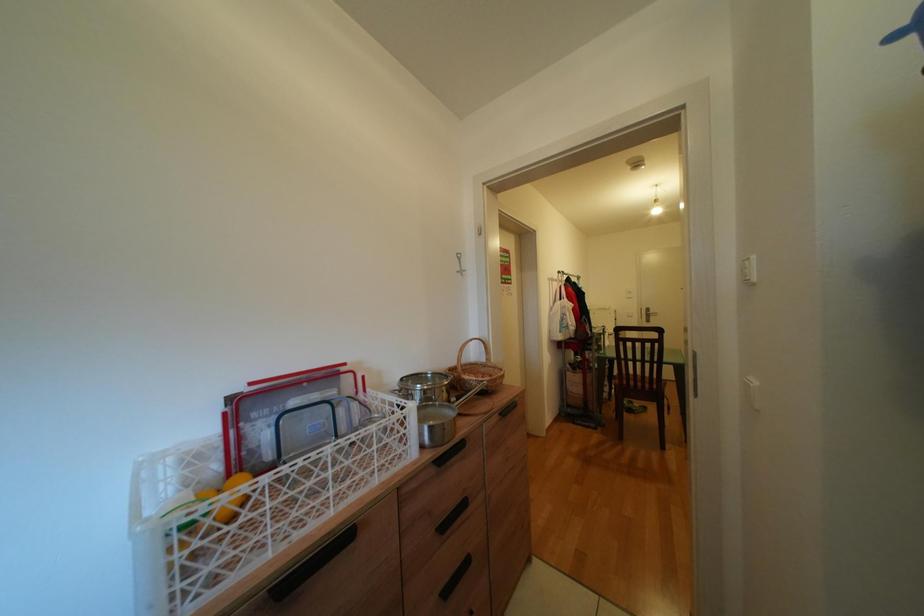
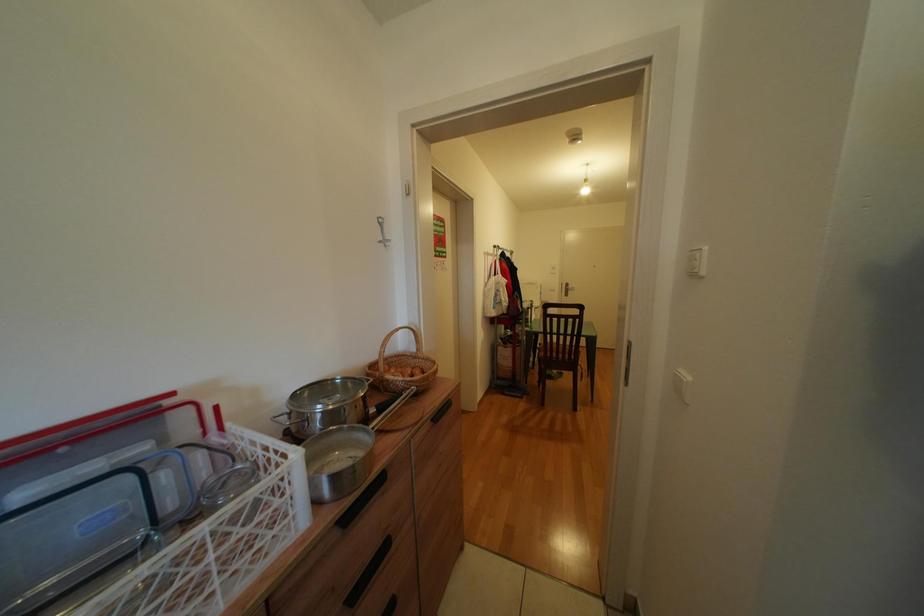
Question: In a continuous first-person perspective shot, in which direction is the camera moving?

Choices:
 (A) Left
 (B) Right
 (C) Forward
 (D) Backward

Answer: (C)